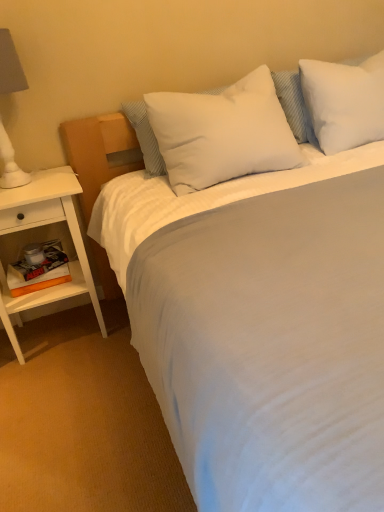
At what (x,y) coordinates should I click in order to perform the action: click on vacant area located to the right-hand side of white matte lampshade at left. Please return your answer as a coordinate pair (x, y). The width and height of the screenshot is (384, 512). Looking at the image, I should click on (63, 180).